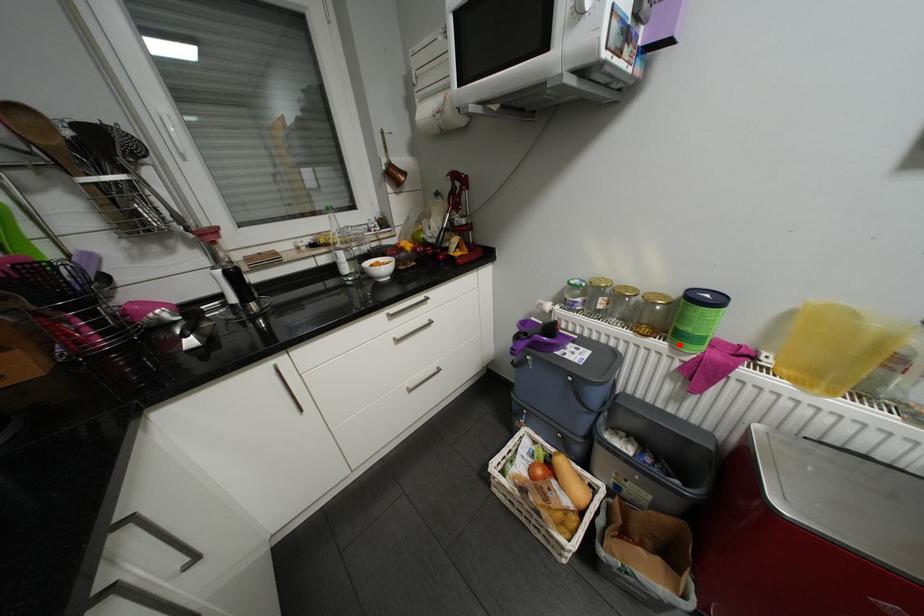
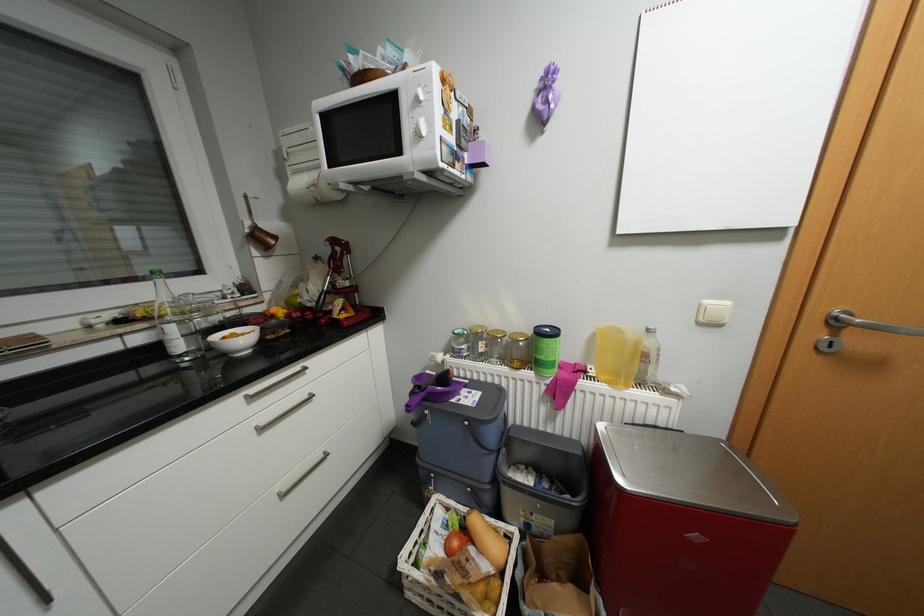
The point at the highlighted location is marked in the first image. Where is the corresponding point in the second image?

(544, 373)